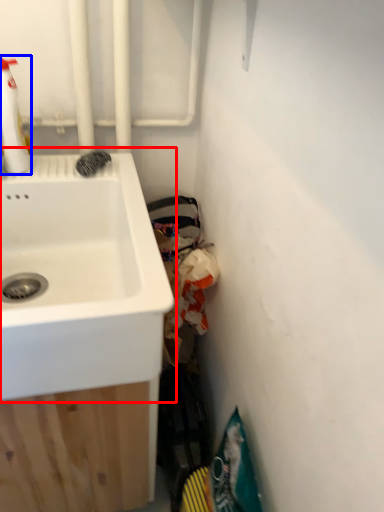
Question: Which point is closer to the camera, sink (highlighted by a red box) or cleaning product (highlighted by a blue box)?

Choices:
 (A) sink
 (B) cleaning product

Answer: (A)